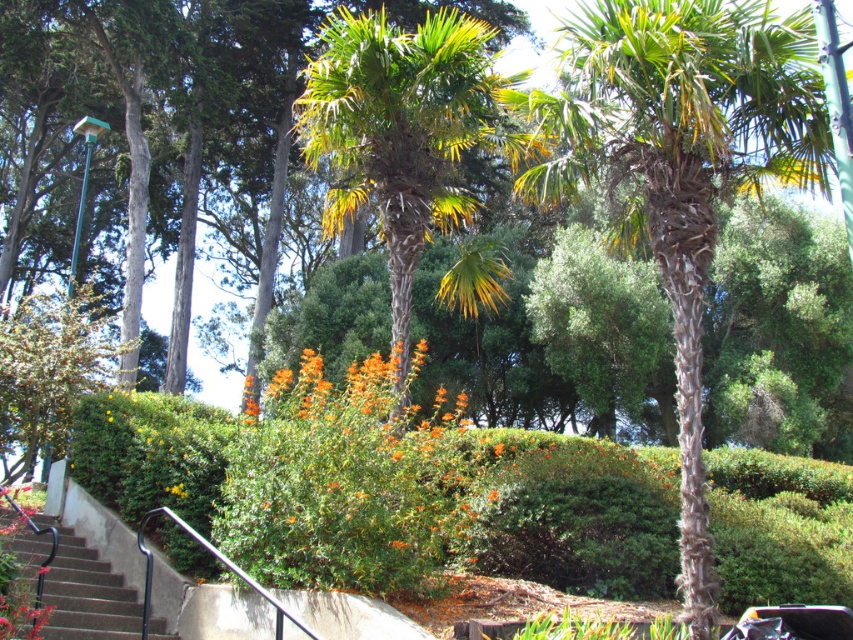
Is green textured palm tree at center taller than green leafy palm at center?

In fact, green textured palm tree at center may be shorter than green leafy palm at center.

Image resolution: width=853 pixels, height=640 pixels. Identify the location of green textured palm tree at center. (679, 168).

Who is higher up, green leafy palm at center or orange fuzzy bush at center?

green leafy palm at center is higher up.

Who is more distant from viewer, (x=343, y=147) or (x=374, y=392)?

Point (x=343, y=147)

Image resolution: width=853 pixels, height=640 pixels. I want to click on green leafy palm at center, so click(x=402, y=132).

Which is behind, point (682, 99) or point (442, 538)?

The point (442, 538) is more distant.

Is green textured palm tree at center bigger than orange fuzzy bush at center?

No.

Which is behind, point (682, 468) or point (260, 509)?

Point (682, 468)

Locate an element on the screen. green textured palm tree at center is located at coordinates (679, 168).